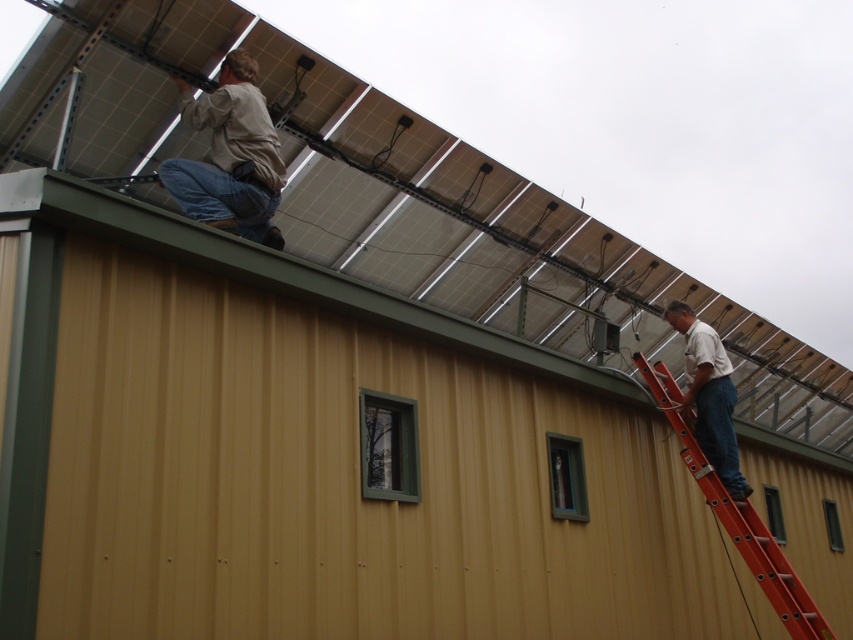
Question: Estimate the real-world distances between objects in this image. Which object is closer to the orange fiberglass ladder at upper right?

Choices:
 (A) light brown denim jeans at upper center
 (B) white matte shirt at right
 (C) metallic solar panels at upper center

Answer: (B)

Question: Which point appears farthest from the camera in this image?

Choices:
 (A) (244, 224)
 (B) (570, 296)
 (C) (697, 420)
 (D) (750, 504)

Answer: (B)

Question: Which is nearer to the orange fiberglass ladder at upper right?

Choices:
 (A) metallic solar panels at upper center
 (B) white matte shirt at right
 (C) light brown denim jeans at upper center

Answer: (B)

Question: Can you confirm if light brown denim jeans at upper center is wider than white matte shirt at right?

Choices:
 (A) yes
 (B) no

Answer: (A)

Question: In this image, where is metallic solar panels at upper center located relative to orange fiberglass ladder at upper right?

Choices:
 (A) right
 (B) left

Answer: (B)

Question: Does light brown denim jeans at upper center appear under orange fiberglass ladder at upper right?

Choices:
 (A) yes
 (B) no

Answer: (B)